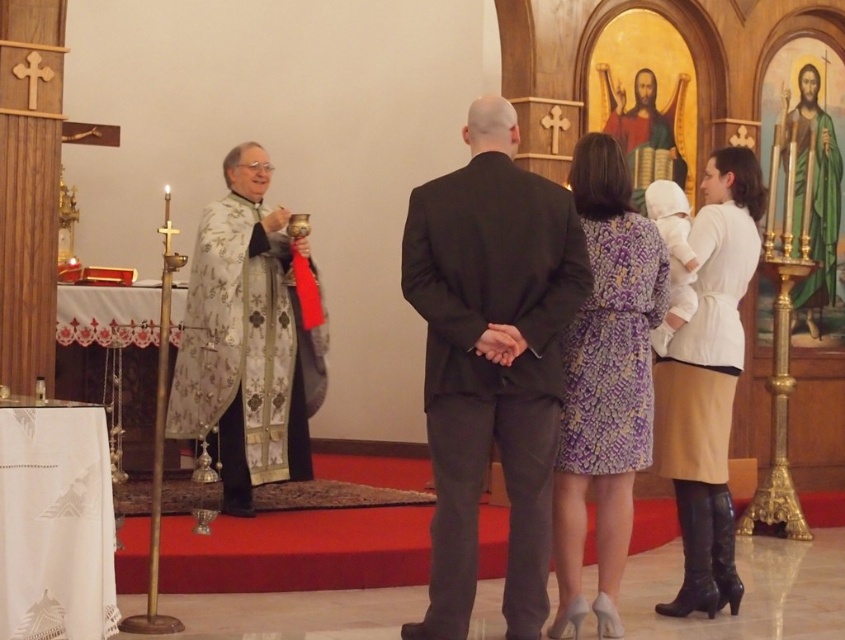
Question: Estimate the real-world distances between objects in this image. Which object is farther from the silver embroidered robe at left?

Choices:
 (A) black matte suit at center
 (B) purple printed dress at center

Answer: (B)

Question: Which object is positioned farthest from the silver embroidered robe at left?

Choices:
 (A) black matte suit at center
 (B) purple printed dress at center

Answer: (B)

Question: Is black matte suit at center closer to camera compared to purple printed dress at center?

Choices:
 (A) no
 (B) yes

Answer: (B)

Question: Is silver embroidered robe at left bigger than purple printed dress at center?

Choices:
 (A) no
 (B) yes

Answer: (B)

Question: Which point is farther to the camera?

Choices:
 (A) purple printed dress at center
 (B) black matte suit at center

Answer: (A)

Question: Can you confirm if black matte suit at center is wider than purple printed dress at center?

Choices:
 (A) no
 (B) yes

Answer: (B)